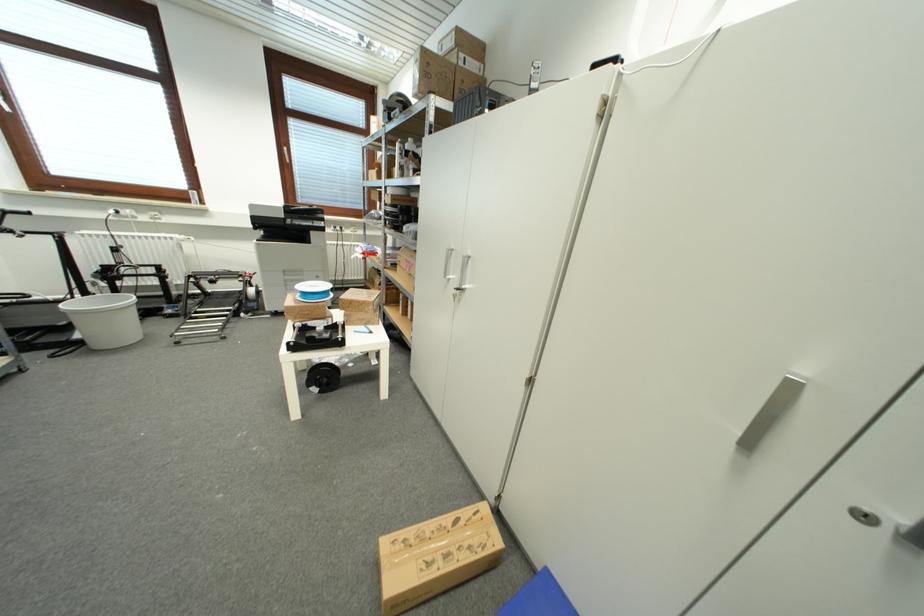
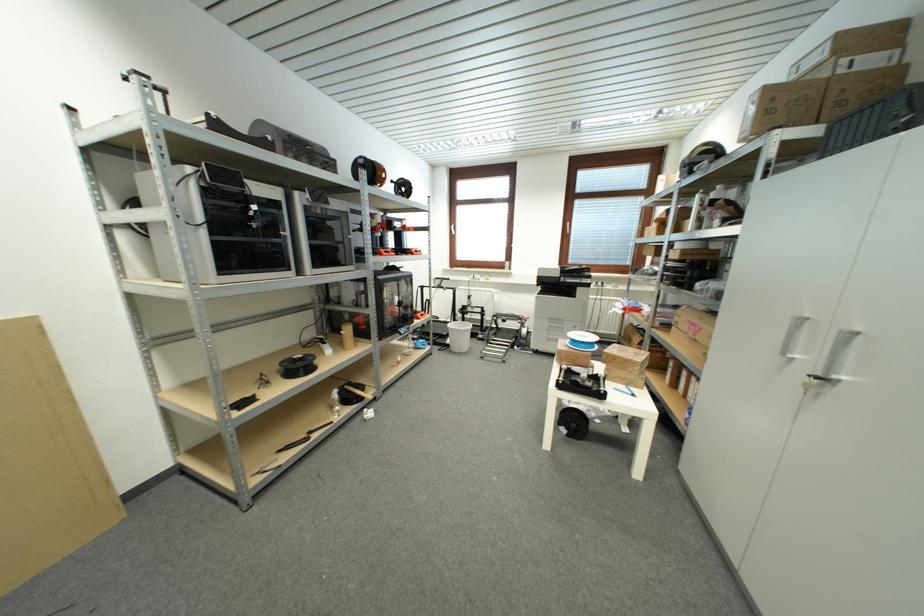
Where in the second image is the point corresponding to (320,392) from the first image?

(568, 432)